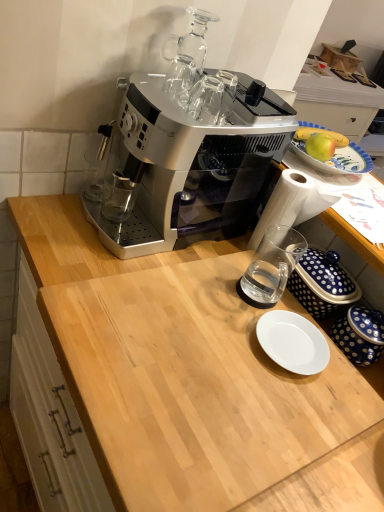
Where is `free space that is to the left of clear glass cup at center`? This screenshot has height=512, width=384. free space that is to the left of clear glass cup at center is located at coordinates point(195,275).